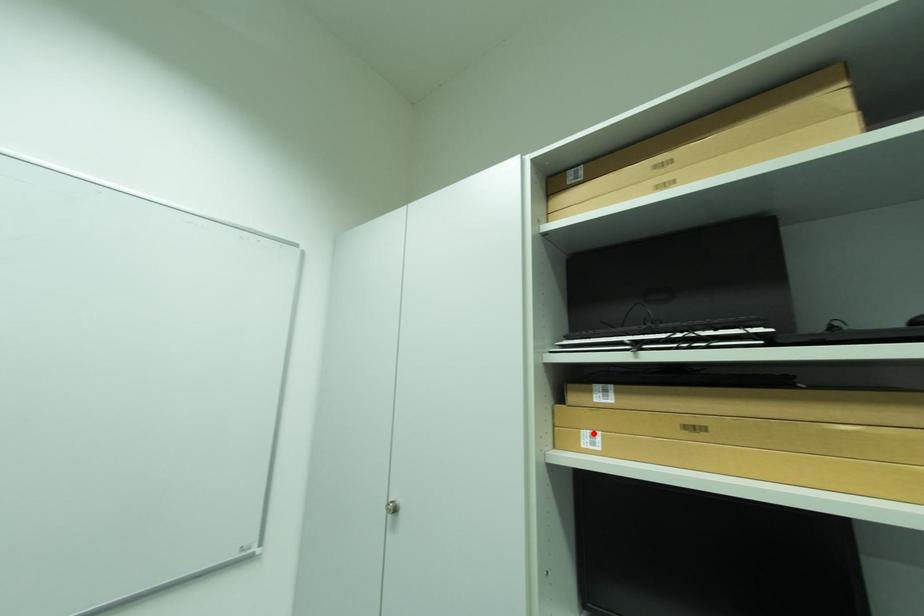
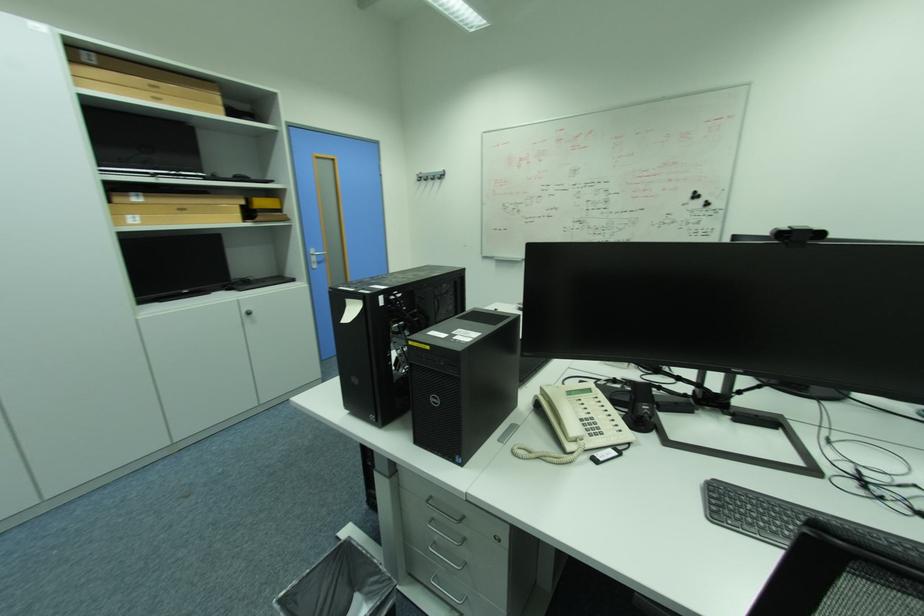
Find the pixel in the second image that matches the highlighted location in the first image.

(136, 217)